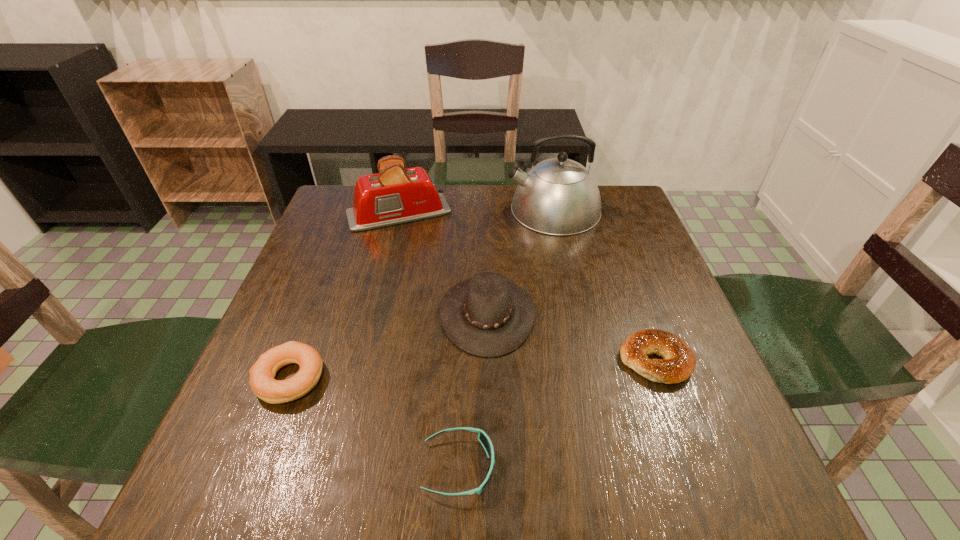
Locate an element on the screen. The image size is (960, 540). bagel at the left edge is located at coordinates (262, 373).

At what (x,y) coordinates should I click in order to perform the action: click on kettle at the right edge. Please return your answer as a coordinate pair (x, y). This screenshot has width=960, height=540. Looking at the image, I should click on (558, 196).

The height and width of the screenshot is (540, 960). What are the coordinates of `bagel that is positioned at the right edge` in the screenshot? It's located at (678, 364).

Image resolution: width=960 pixels, height=540 pixels. I want to click on object that is positioned at the far left corner, so click(x=395, y=195).

Identify the location of object at the far right corner. (558, 196).

Locate an element on the screen. The image size is (960, 540). free space at the far edge of the desktop is located at coordinates (469, 222).

In the image, there is a desktop. Where is `free space at the near edge`? free space at the near edge is located at coordinates (311, 492).

This screenshot has height=540, width=960. I want to click on blank space at the left edge of the desktop, so click(320, 341).

In the image, there is a desktop. Where is `free space at the right edge`? Image resolution: width=960 pixels, height=540 pixels. free space at the right edge is located at coordinates (621, 261).

This screenshot has width=960, height=540. Identify the location of vacant space at the far left corner of the desktop. (325, 209).